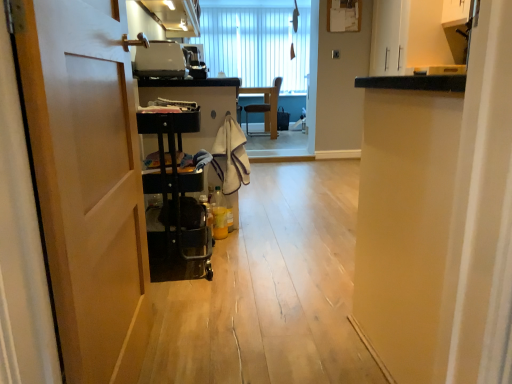
Question: Is matte white cabinet at upper center behind white vertical blinds at upper center?

Choices:
 (A) no
 (B) yes

Answer: (A)

Question: Is matte white cabinet at upper center to the left of white vertical blinds at upper center from the viewer's perspective?

Choices:
 (A) no
 (B) yes

Answer: (B)

Question: Is matte white cabinet at upper center oriented towards white vertical blinds at upper center?

Choices:
 (A) yes
 (B) no

Answer: (B)

Question: Does matte white cabinet at upper center lie in front of white vertical blinds at upper center?

Choices:
 (A) yes
 (B) no

Answer: (A)

Question: Can you see matte white cabinet at upper center touching white vertical blinds at upper center?

Choices:
 (A) no
 (B) yes

Answer: (A)

Question: Does matte white cabinet at upper center have a smaller size compared to white vertical blinds at upper center?

Choices:
 (A) yes
 (B) no

Answer: (B)

Question: Considering the relative sizes of white vertical blinds at upper center and matte black toaster at upper center in the image provided, is white vertical blinds at upper center shorter than matte black toaster at upper center?

Choices:
 (A) no
 (B) yes

Answer: (A)

Question: Does white vertical blinds at upper center come in front of matte black toaster at upper center?

Choices:
 (A) yes
 (B) no

Answer: (B)

Question: Does white vertical blinds at upper center have a larger size compared to matte black toaster at upper center?

Choices:
 (A) yes
 (B) no

Answer: (A)

Question: From a real-world perspective, does white vertical blinds at upper center sit lower than matte black toaster at upper center?

Choices:
 (A) no
 (B) yes

Answer: (A)

Question: Is white vertical blinds at upper center touching matte black toaster at upper center?

Choices:
 (A) yes
 (B) no

Answer: (B)

Question: Could you tell me if white vertical blinds at upper center is facing matte black toaster at upper center?

Choices:
 (A) yes
 (B) no

Answer: (A)

Question: Can you confirm if wooden chair at center is positioned to the right of beige textured towel at center?

Choices:
 (A) yes
 (B) no

Answer: (A)